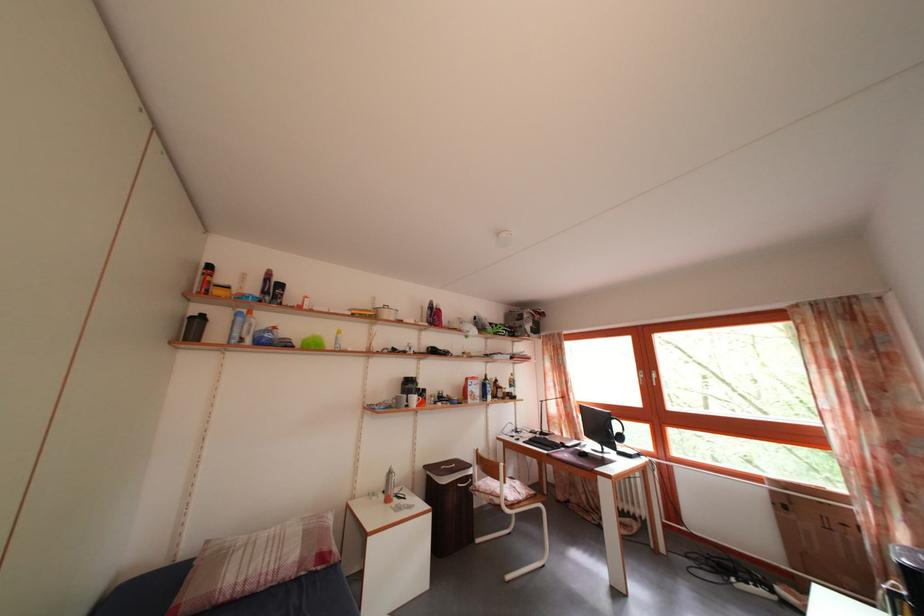
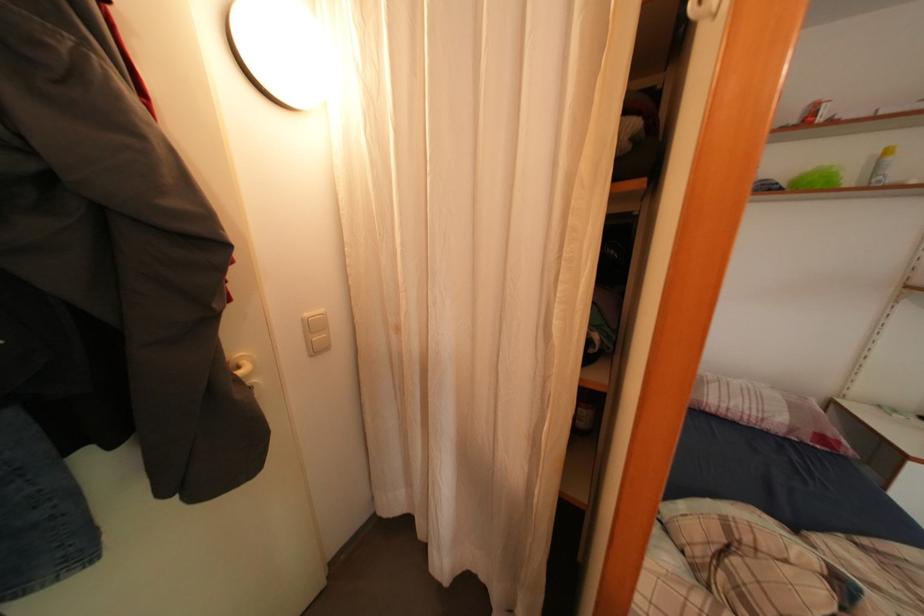
Based on the continuous images, in which direction is the camera rotating?

The camera's rotation is toward left-down.